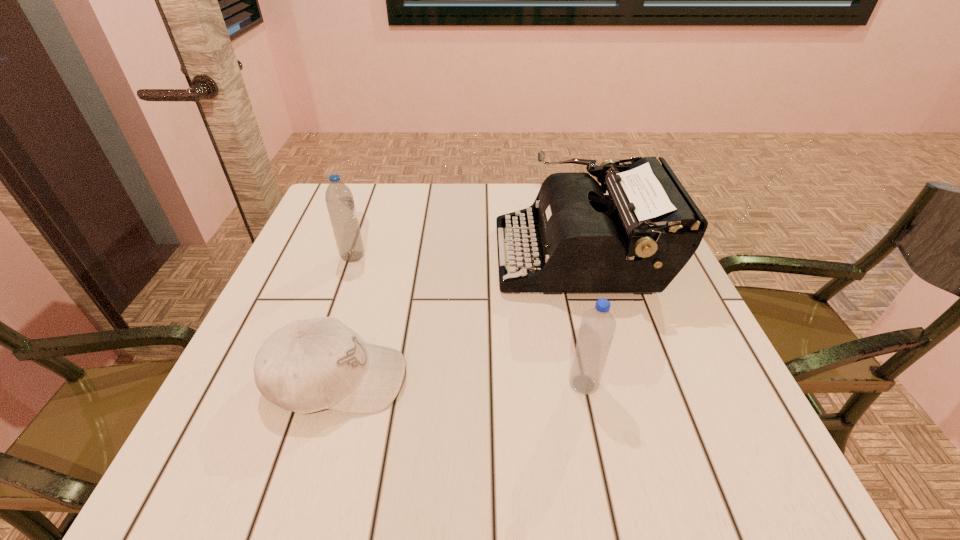
The image size is (960, 540). I want to click on free space that satisfies the following two spatial constraints: 1. on the front side of the right water bottle; 2. on the left side of the left water bottle, so click(308, 384).

Image resolution: width=960 pixels, height=540 pixels. What are the coordinates of `blank space that satisfies the following two spatial constraints: 1. on the front-facing side of the nearer water bottle; 2. on the left side of the shortest object` in the screenshot? It's located at (336, 384).

Locate an element on the screen. This screenshot has width=960, height=540. free space in the image that satisfies the following two spatial constraints: 1. on the back side of the right water bottle; 2. on the front-facing side of the baseball cap is located at coordinates (583, 379).